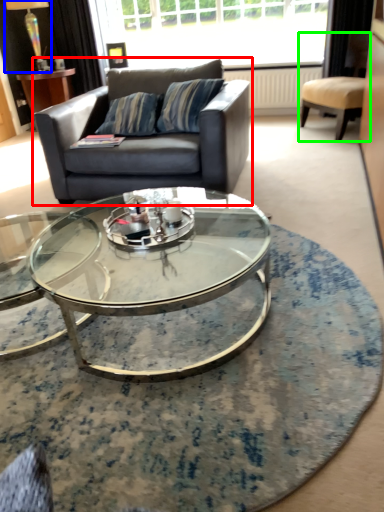
Question: Considering the real-world distances, which object is farthest from studio couch (highlighted by a red box)? lamp (highlighted by a blue box) or chair (highlighted by a green box)?

Choices:
 (A) lamp
 (B) chair

Answer: (A)